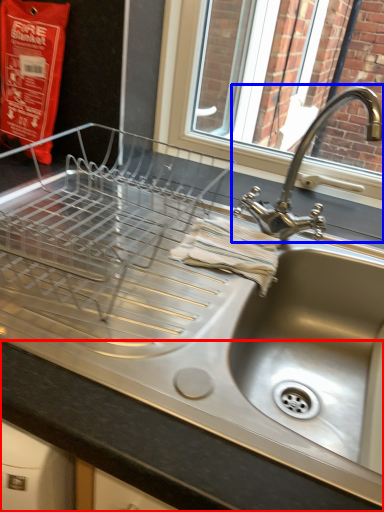
Question: Among these objects, which one is farthest to the camera, counter top (highlighted by a red box) or tap (highlighted by a blue box)?

Choices:
 (A) counter top
 (B) tap

Answer: (B)